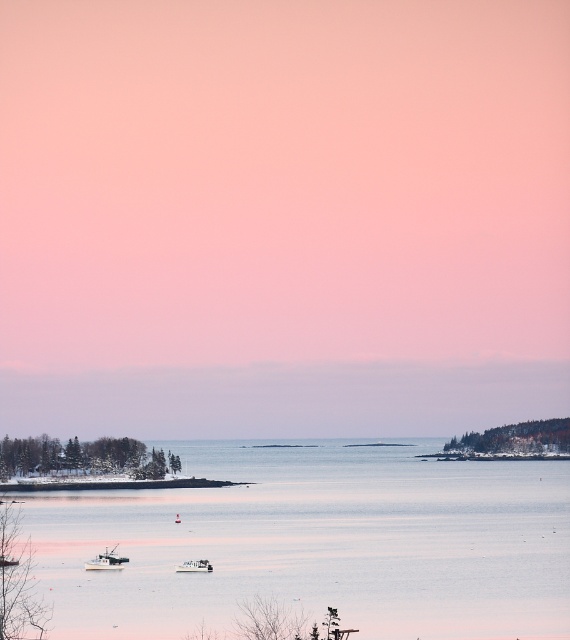
You are a marine biologist studying water clarity in coastal areas. You have a device that can only analyze water samples taken from coordinates between 0.8 and 0.9 on the x and y axes. Based on the image, can you determine if the clear water at center is within the device range?

The clear water at center is located at coordinates point (315, 545). Since both the x and y values fall within the 0.8 to 0.9 range, the clear water at center is within the device range.